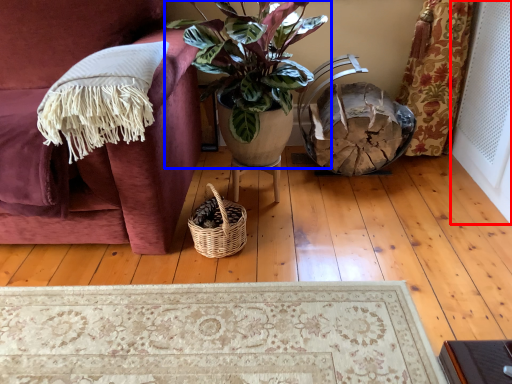
Question: Among these objects, which one is nearest to the camera, screen door (highlighted by a red box) or houseplant (highlighted by a blue box)?

Choices:
 (A) screen door
 (B) houseplant

Answer: (A)